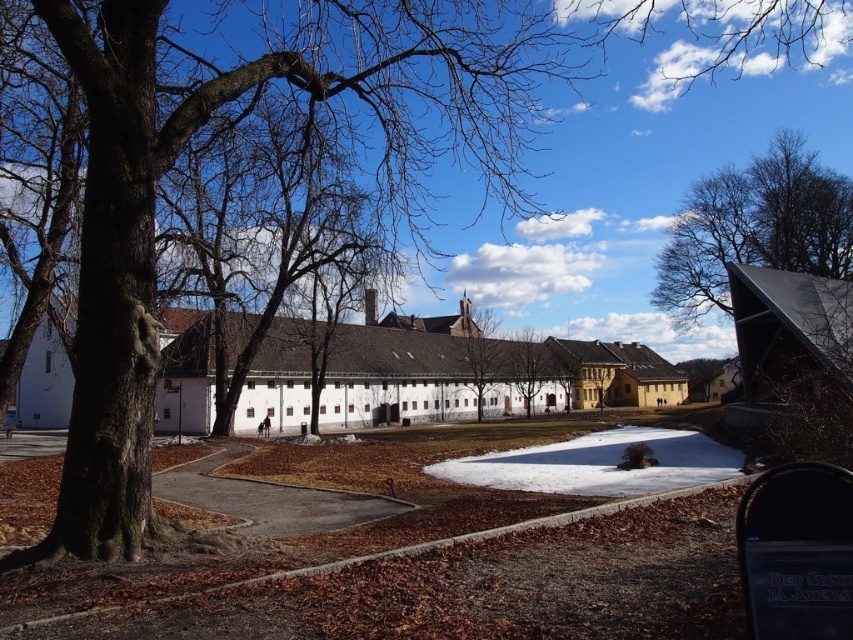
You are standing at the point marked by the coordinates point (480, 376) in the scene. What is the surface you are currently standing on?

The point (480, 376) is on white matte building at center, so you are standing on the white matte building at center.

You are standing at the edge of the pathway and want to take a photo of the bare branches at upper right and the brown textured tree at center. Which object will appear closer to the camera in the photo?

The bare branches at upper right will appear closer to the camera in the photo because they are positioned in front of the brown textured tree at center.